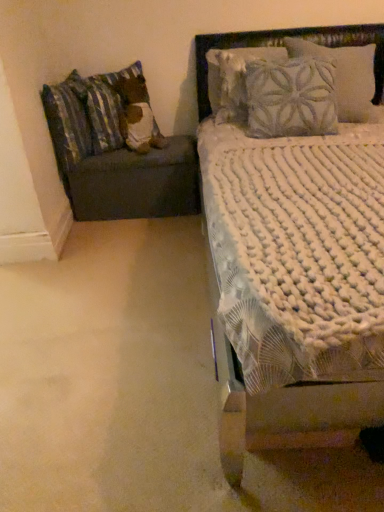
Question: Is striped fabric pillow at left, the 1th pillow positioned from the left, inside the boundaries of white textured bed at upper right, or outside?

Choices:
 (A) inside
 (B) outside

Answer: (B)

Question: From a real-world perspective, is striped fabric pillow at left, placed as the 2th pillow when sorted from right to left, physically located above or below white textured bed at upper right?

Choices:
 (A) above
 (B) below

Answer: (A)

Question: Which of these objects is positioned farthest from the dark gray fabric ottoman at left?

Choices:
 (A) fluffy fabric headboard at upper right
 (B) white textured bed at upper right
 (C) striped fabric pillow at left, placed as the 2th pillow when sorted from right to left
 (D) fluffy fabric pillow at left, the 1th pillow positioned from the right

Answer: (A)

Question: Considering the real-world distances, which object is closest to the dark gray fabric ottoman at left?

Choices:
 (A) striped fabric pillow at left, the 1th pillow positioned from the left
 (B) fluffy fabric pillow at left, the 1th pillow positioned from the right
 (C) white textured bed at upper right
 (D) fluffy fabric headboard at upper right

Answer: (B)